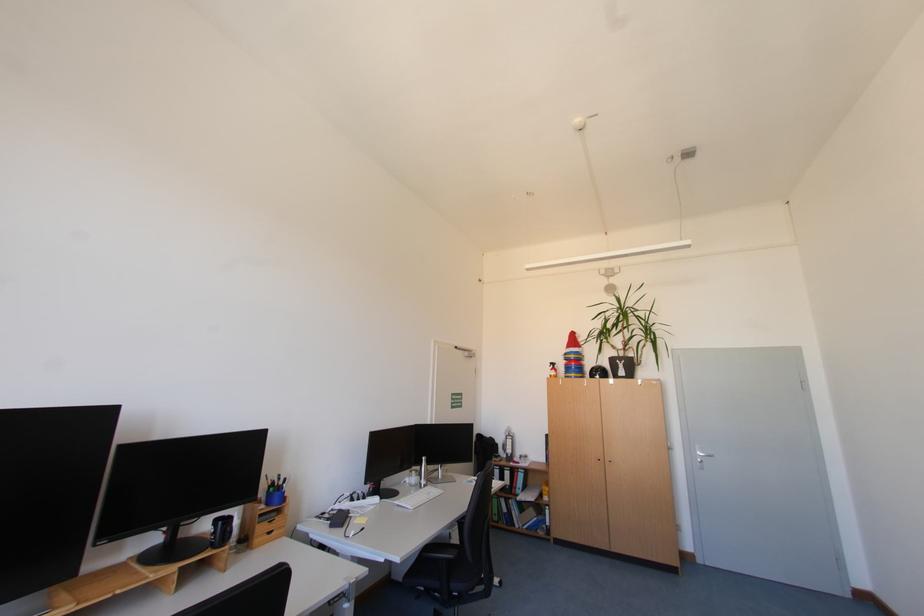
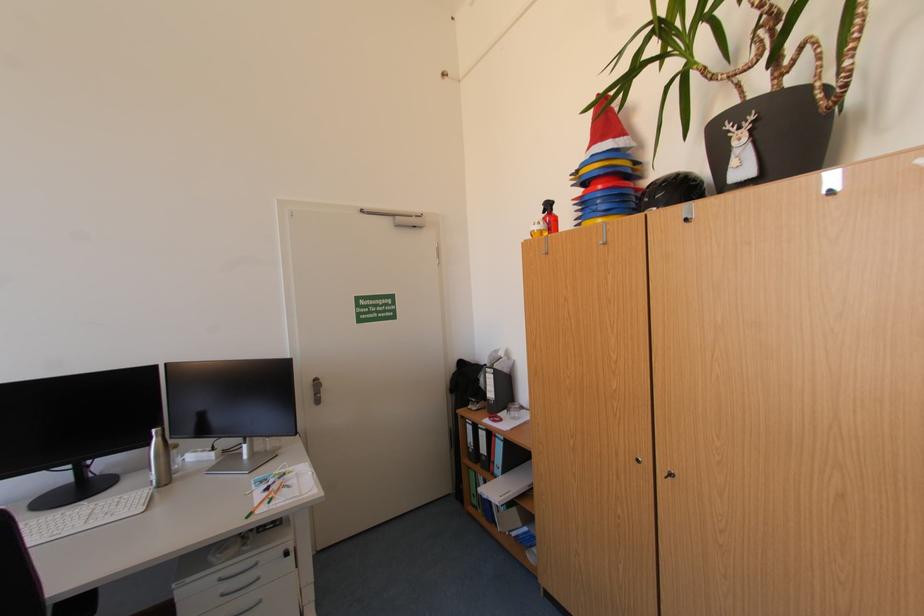
Locate, in the second image, the point that corresponds to (x=432, y=459) in the first image.

(161, 431)